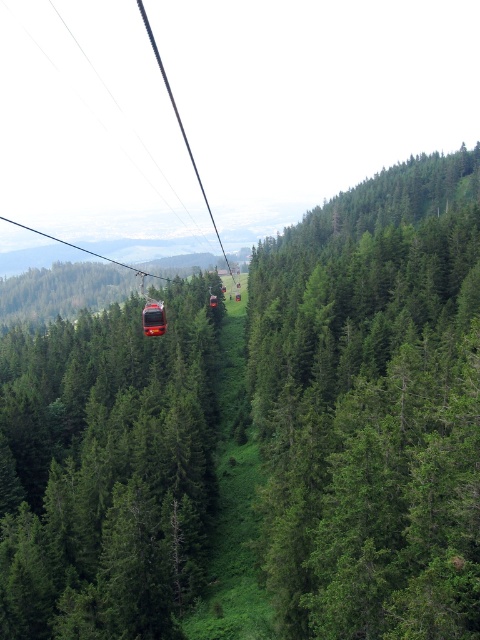
You are a hiker planning to take a photo from the cable car. You want to include both the green leafy tree at center and the green matte tree at center in your shot. Which tree should you focus on to ensure both are in the frame?

The green leafy tree at center is much taller than the green matte tree at center, so focusing on the taller tree will ensure both are visible in the frame.

You are a passenger in the cable car and want to take a photo of the green matte tree at center. Where should you aim your camera to capture it?

You should aim your camera at point (107,470) to capture the green matte tree at center.

You are a passenger in the metallic cable car at center and want to look out the window to see the green matte tree at center. Is the tree visible from your current position inside the cable car?

The green matte tree at center is located below the metallic cable car at center, so the tree is visible from the window as it is positioned beneath the car.